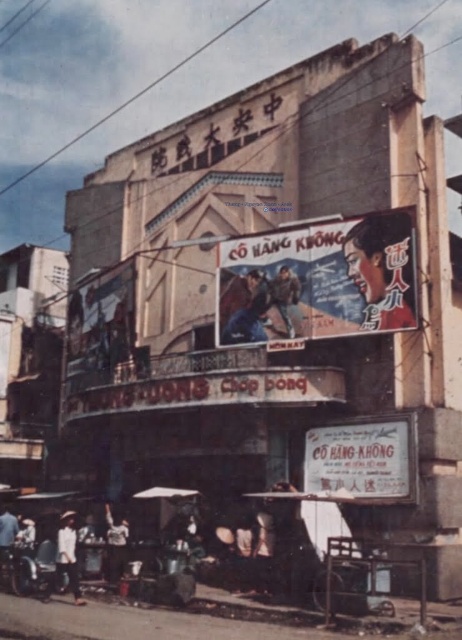
You are a delivery person standing at the entrance of the Central Theater. You see a white cotton shirt at lower left and a light brown wooden cart at lower left. Your delivery package is too heavy to lift, so you need to place it on the nearest object. Which object should you choose?

The light brown wooden cart at lower left is the better choice because it is a stable surface for placing heavy items, unlike the white cotton shirt at lower left which is clothing and cannot support weight.